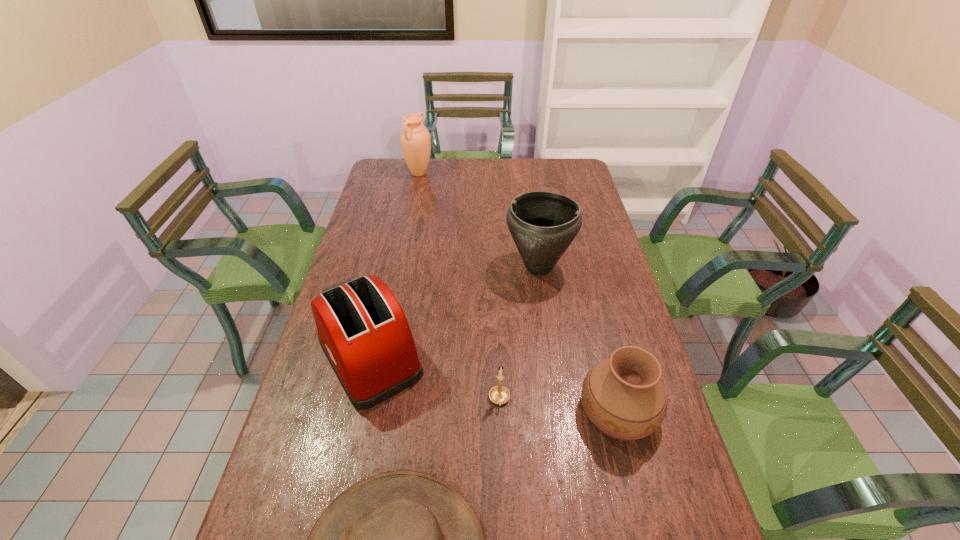
Identify the location of vacant region that satisfies the following two spatial constraints: 1. on the handle side of the nearest urn; 2. on the right side of the third object from right to left. (500, 410).